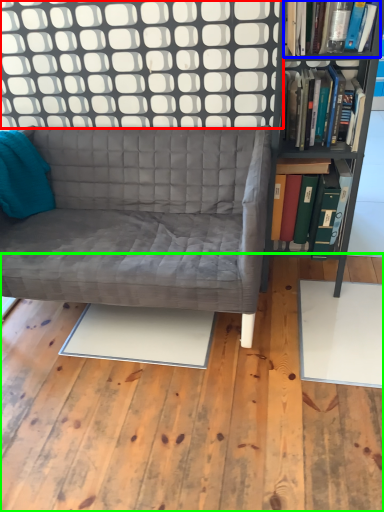
Question: Based on their relative distances, which object is nearer to glass door (highlighted by a red box)? Choose from book (highlighted by a blue box) and plywood (highlighted by a green box).

Choices:
 (A) book
 (B) plywood

Answer: (A)